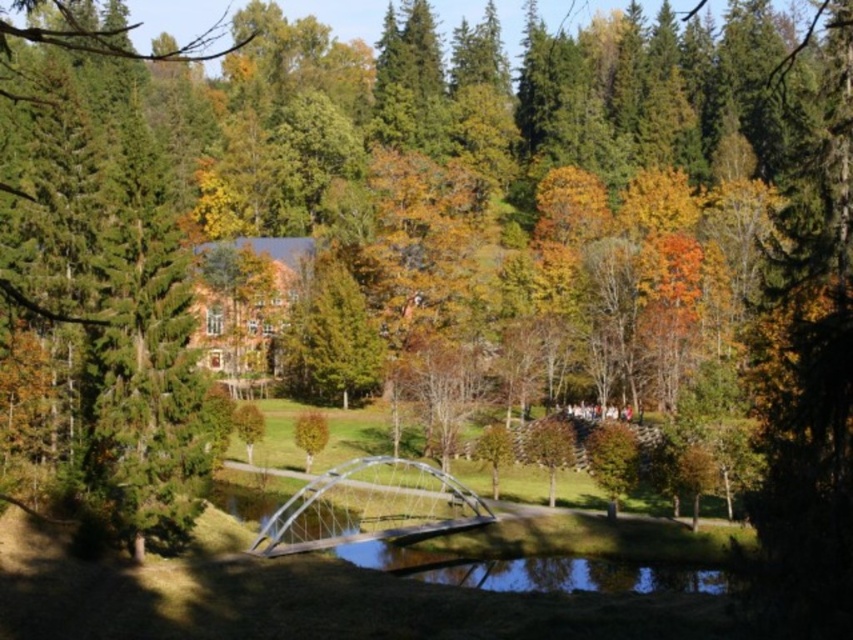
Question: Does green coniferous tree at left appear over yellow-green leafy tree at center?

Choices:
 (A) no
 (B) yes

Answer: (B)

Question: Which of the following is the farthest from the observer?

Choices:
 (A) yellow-green leafy tree at center
 (B) green coniferous tree at left
 (C) clear glass bridge at center

Answer: (A)

Question: Is green coniferous tree at left above yellow-green leafy tree at center?

Choices:
 (A) no
 (B) yes

Answer: (B)

Question: Is green coniferous tree at left bigger than clear glass bridge at center?

Choices:
 (A) yes
 (B) no

Answer: (A)

Question: Which object appears farthest from the camera in this image?

Choices:
 (A) clear glass bridge at center
 (B) yellow-green leafy tree at center
 (C) green coniferous tree at left

Answer: (B)

Question: Which object is farther from the camera taking this photo?

Choices:
 (A) clear glass bridge at center
 (B) yellow-green leafy tree at center
 (C) green coniferous tree at left

Answer: (B)